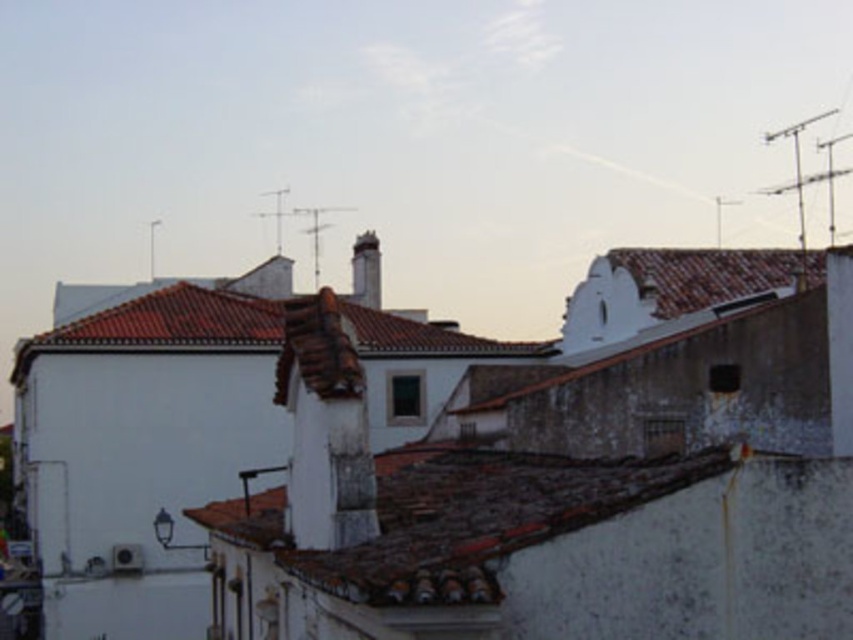
You are an architect analyzing the buildings in the scene. Which object, the brown tile roof at center or the white stone chimney at center, is positioned to the east side of the other?

The brown tile roof at center is to the right of white stone chimney at center, so if the image is oriented with right as east, the brown tile roof at center is positioned to the east side of the white stone chimney at center.

You are an architect analyzing the buildings in the scene. Which object, the brown tile roof at center or the white stone chimney at center, would require more materials to construct based on their size?

The brown tile roof at center is larger in size than the white stone chimney at center, so it would require more materials to construct.

You are a drone operator trying to capture a photo of the brown tile roof at center. The drone has a camera with a 100mm lens. According to the coordinates provided, where should you position the drone to ensure the roof is centered in the frame?

The brown tile roof at center is located at coordinates point [450,518], so positioning the drone to focus on that point will center the roof in the frame.